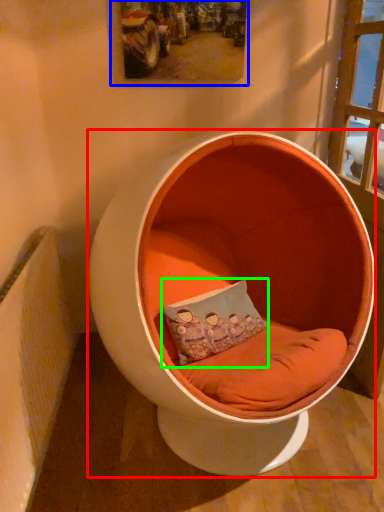
Question: Which object is the farthest from furniture (highlighted by a red box)? Choose among these: picture frame (highlighted by a blue box) or pillow (highlighted by a green box).

Choices:
 (A) picture frame
 (B) pillow

Answer: (A)